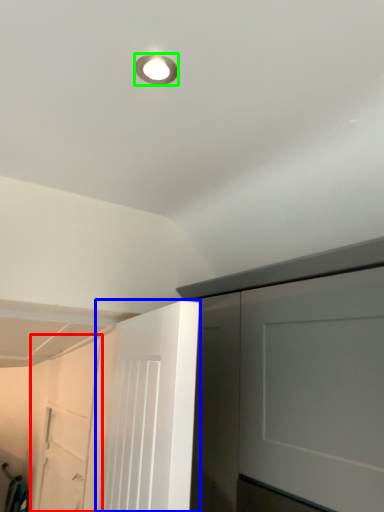
Question: Considering the real-world distances, which object is closest to garage door (highlighted by a red box)? door (highlighted by a blue box) or droplight (highlighted by a green box).

Choices:
 (A) door
 (B) droplight

Answer: (A)